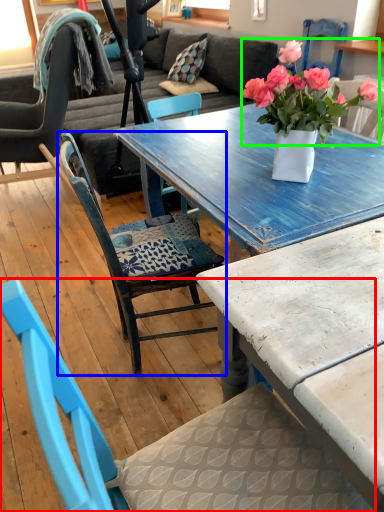
Question: Estimate the real-world distances between objects in this image. Which object is farther from chair (highlighted by a red box), chair (highlighted by a blue box) or flower (highlighted by a green box)?

Choices:
 (A) chair
 (B) flower

Answer: (B)